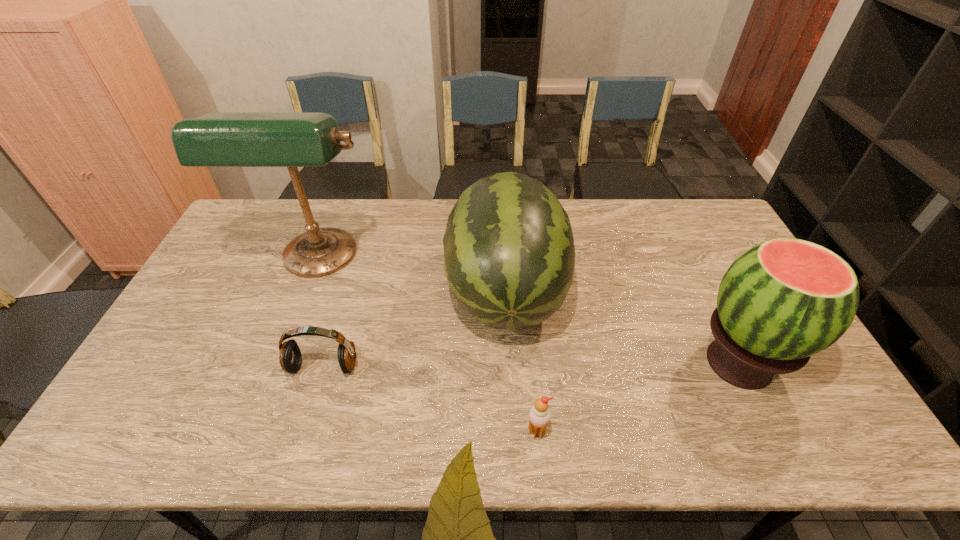
Identify the location of table lamp. Image resolution: width=960 pixels, height=540 pixels. (219, 139).

Where is `the left watermelon`? the left watermelon is located at coordinates (509, 256).

The image size is (960, 540). What are the coordinates of `the rightmost object` in the screenshot? It's located at (784, 300).

Find the location of a particular element. This screenshot has height=540, width=960. headset is located at coordinates (290, 358).

This screenshot has height=540, width=960. Identify the location of the nearest object. (539, 415).

Identify the location of vacant region located above the green lampshade of the table lamp. The width and height of the screenshot is (960, 540). (257, 419).

I want to click on free spot located on the right of the left watermelon, so click(649, 292).

Find the location of `vacant space situated 0.210m on the left of the rightmost object`. vacant space situated 0.210m on the left of the rightmost object is located at coordinates (611, 363).

Find the location of `free location located on the ear cups of the headset`. free location located on the ear cups of the headset is located at coordinates (311, 408).

Find the location of a particular element. This screenshot has width=960, height=540. object that is at the far edge is located at coordinates (219, 139).